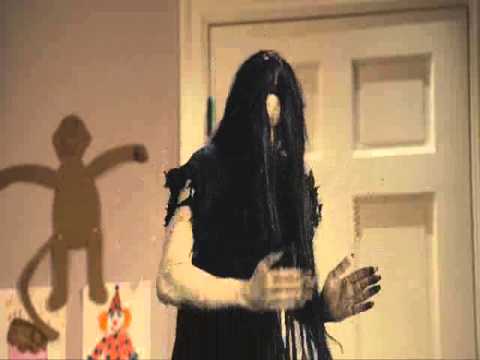
The width and height of the screenshot is (480, 360). I want to click on hinge, so pos(209,130).